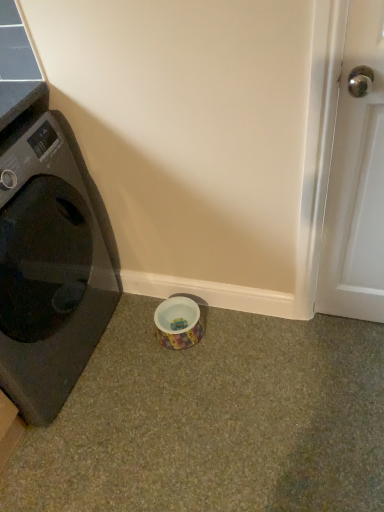
The width and height of the screenshot is (384, 512). I want to click on free area in between multicolored ceramic bowl at lower center and white glossy door handle at right, so click(265, 332).